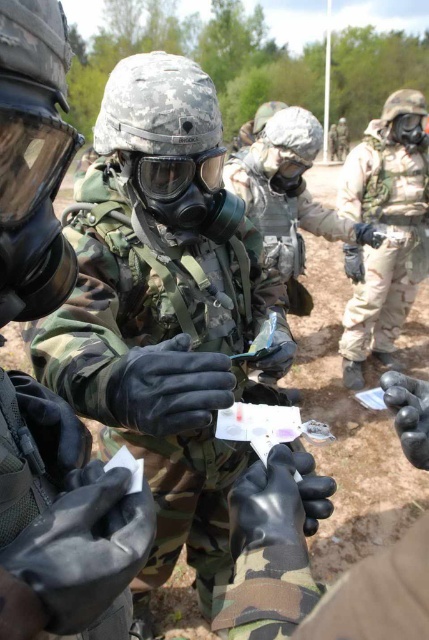
Looking at this image, you are a member of this military training exercise. You need to retrieve the matte black gas mask at center from behind the camouflage fabric gas mask at center. What must you do first?

You must move the camouflage fabric gas mask at center out of the way to access the matte black gas mask at center since it is currently behind it.

You are a trainee in the military exercise described. You need to reach the matte black gas mask at center to inspect its filter. Can you safely reach it from your current position without moving closer than 12 inches?

The matte black gas mask at center is 13.32 inches away from the viewer. Since the required minimum distance is 12 inches, you can safely reach it without moving closer than that distance.